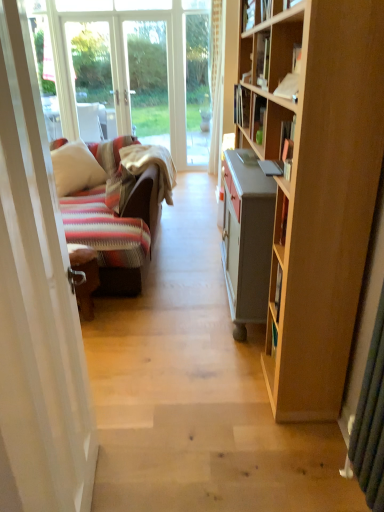
Question: In terms of height, does white soft pillow at left, which appears as the 1th pillow when viewed from the left, look taller or shorter compared to matte black book at upper center, positioned as the second book in back-to-front order?

Choices:
 (A) tall
 (B) short

Answer: (A)

Question: Is white soft pillow at left, which appears as the 1th pillow when viewed from the left, situated inside matte black book at upper center, positioned as the second book in back-to-front order, or outside?

Choices:
 (A) inside
 (B) outside

Answer: (B)

Question: Estimate the real-world distances between objects in this image. Which object is farther from the striped fabric pillow at left, which appears as the 1th pillow when viewed from the right?

Choices:
 (A) matte black book at upper center, which is the 1th book from front to back
 (B) hardcover book at upper right, the 1th book positioned from the back
 (C) white glossy door at left
 (D) white soft pillow at left, marked as the second pillow in a right-to-left arrangement

Answer: (C)

Question: Estimate the real-world distances between objects in this image. Which object is farther from the striped fabric pillow at left, acting as the second pillow starting from the left?

Choices:
 (A) white soft pillow at left, which appears as the 1th pillow when viewed from the left
 (B) white glossy door at left
 (C) matte black book at upper center, positioned as the second book in back-to-front order
 (D) hardcover book at upper right, the second book in the front-to-back sequence

Answer: (B)